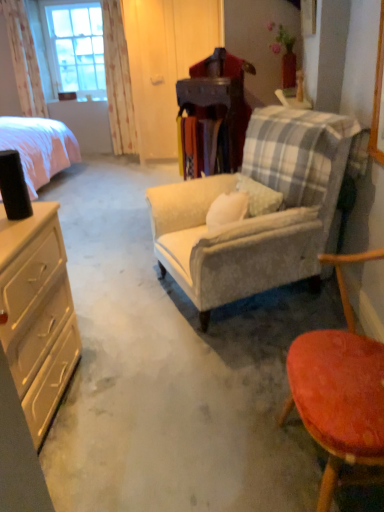
Question: Should I look upward or downward to see white floral fabric curtain at upper left, which ranks as the second curtain in right-to-left order?

Choices:
 (A) up
 (B) down

Answer: (A)

Question: Can you confirm if clear glass window at upper left is wider than white floral fabric curtain at upper left, the first curtain viewed from the left?

Choices:
 (A) yes
 (B) no

Answer: (B)

Question: Is clear glass window at upper left positioned with its back to white floral fabric curtain at upper left, the first curtain viewed from the left?

Choices:
 (A) yes
 (B) no

Answer: (B)

Question: Considering the relative positions of clear glass window at upper left and white floral fabric curtain at upper left, the first curtain viewed from the left, in the image provided, is clear glass window at upper left in front of white floral fabric curtain at upper left, the first curtain viewed from the left,?

Choices:
 (A) yes
 (B) no

Answer: (B)

Question: From the image's perspective, would you say clear glass window at upper left is shown under white floral fabric curtain at upper left, the first curtain viewed from the left?

Choices:
 (A) yes
 (B) no

Answer: (B)

Question: Is clear glass window at upper left smaller than white floral fabric curtain at upper left, the first curtain viewed from the left?

Choices:
 (A) no
 (B) yes

Answer: (A)

Question: Is clear glass window at upper left located outside white floral fabric curtain at upper left, which ranks as the second curtain in right-to-left order?

Choices:
 (A) no
 (B) yes

Answer: (B)

Question: Does matte beige dresser at left touch pink fabric bed at left?

Choices:
 (A) yes
 (B) no

Answer: (B)

Question: Does matte beige dresser at left have a lesser height compared to pink fabric bed at left?

Choices:
 (A) no
 (B) yes

Answer: (A)

Question: Is matte beige dresser at left taller than pink fabric bed at left?

Choices:
 (A) yes
 (B) no

Answer: (A)

Question: Considering the relative sizes of matte beige dresser at left and pink fabric bed at left in the image provided, is matte beige dresser at left wider than pink fabric bed at left?

Choices:
 (A) no
 (B) yes

Answer: (A)

Question: Does matte beige dresser at left come in front of pink fabric bed at left?

Choices:
 (A) yes
 (B) no

Answer: (A)

Question: Considering the relative sizes of matte beige dresser at left and pink fabric bed at left in the image provided, is matte beige dresser at left bigger than pink fabric bed at left?

Choices:
 (A) yes
 (B) no

Answer: (B)

Question: Is smooth orange stool at lower right, which appears as the second chair when viewed from the back, positioned with its back to velvet beige armchair at center, arranged as the first chair when viewed from the back?

Choices:
 (A) no
 (B) yes

Answer: (A)